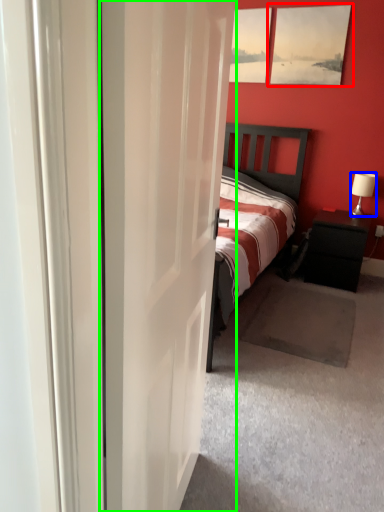
Question: Estimate the real-world distances between objects in this image. Which object is closer to picture frame (highlighted by a red box), lamp (highlighted by a blue box) or door (highlighted by a green box)?

Choices:
 (A) lamp
 (B) door

Answer: (A)